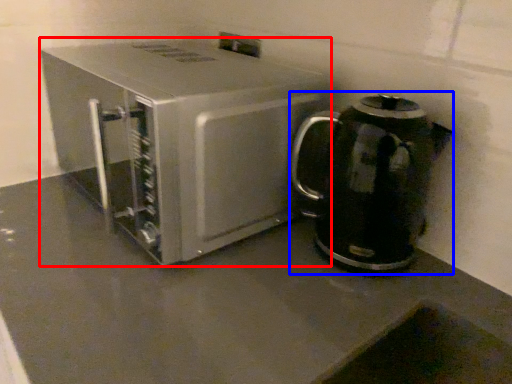
Question: Among these objects, which one is farthest to the camera, kitchen appliance (highlighted by a red box) or kitchen appliance (highlighted by a blue box)?

Choices:
 (A) kitchen appliance
 (B) kitchen appliance

Answer: (B)